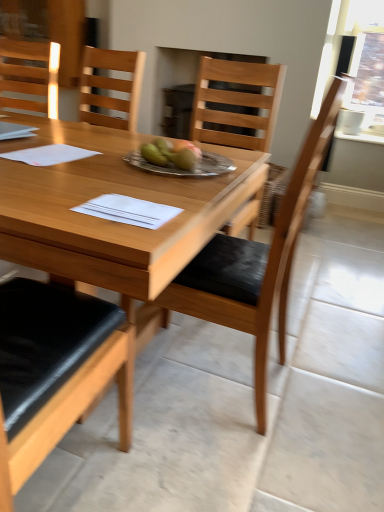
Identify the location of vacant space situated above white paper at center (from a real-world perspective). (130, 206).